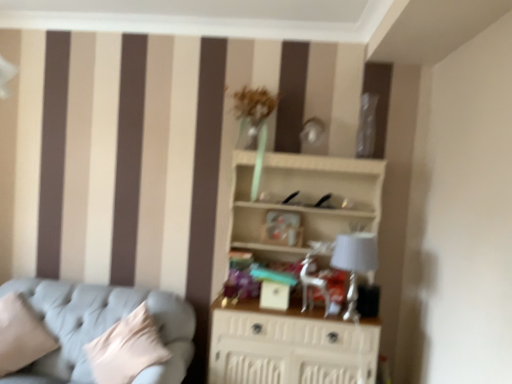
Question: Can you confirm if silver metallic swivel chair at center is taller than white wood shelf at center?

Choices:
 (A) no
 (B) yes

Answer: (A)

Question: Considering the relative sizes of silver metallic swivel chair at center and white wood shelf at center in the image provided, is silver metallic swivel chair at center smaller than white wood shelf at center?

Choices:
 (A) no
 (B) yes

Answer: (B)

Question: Is silver metallic swivel chair at center facing away from white wood shelf at center?

Choices:
 (A) yes
 (B) no

Answer: (A)

Question: Considering the relative positions of silver metallic swivel chair at center and white wood shelf at center in the image provided, is silver metallic swivel chair at center to the right of white wood shelf at center from the viewer's perspective?

Choices:
 (A) yes
 (B) no

Answer: (A)

Question: Considering the relative sizes of silver metallic swivel chair at center and white wood shelf at center in the image provided, is silver metallic swivel chair at center wider than white wood shelf at center?

Choices:
 (A) no
 (B) yes

Answer: (A)

Question: Is white wood shelf at center completely or partially inside silver metallic swivel chair at center?

Choices:
 (A) yes
 (B) no

Answer: (B)

Question: Is light blue fabric couch at lower left taller than silver metallic swivel chair at center?

Choices:
 (A) yes
 (B) no

Answer: (A)

Question: From the image's perspective, does light blue fabric couch at lower left appear lower than silver metallic swivel chair at center?

Choices:
 (A) yes
 (B) no

Answer: (A)

Question: Is light blue fabric couch at lower left positioned far away from silver metallic swivel chair at center?

Choices:
 (A) yes
 (B) no

Answer: (A)

Question: From the image's perspective, is light blue fabric couch at lower left above silver metallic swivel chair at center?

Choices:
 (A) no
 (B) yes

Answer: (A)

Question: Is light blue fabric couch at lower left closer to camera compared to silver metallic swivel chair at center?

Choices:
 (A) no
 (B) yes

Answer: (B)

Question: From a real-world perspective, is light blue fabric couch at lower left physically above silver metallic swivel chair at center?

Choices:
 (A) no
 (B) yes

Answer: (A)

Question: Does beige fabric pillow at lower left appear on the right side of silver metallic swivel chair at center?

Choices:
 (A) no
 (B) yes

Answer: (A)